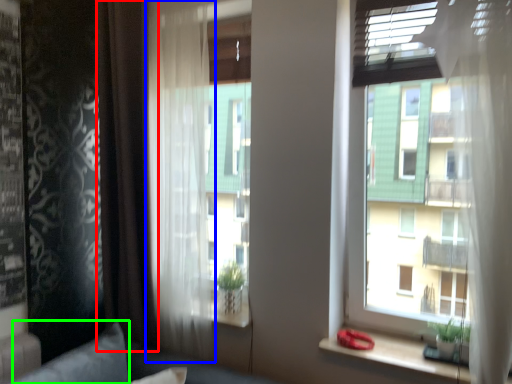
Question: Which object is the closest to the curtain (highlighted by a red box)? Choose among these: curtain (highlighted by a blue box) or pillow (highlighted by a green box).

Choices:
 (A) curtain
 (B) pillow

Answer: (A)